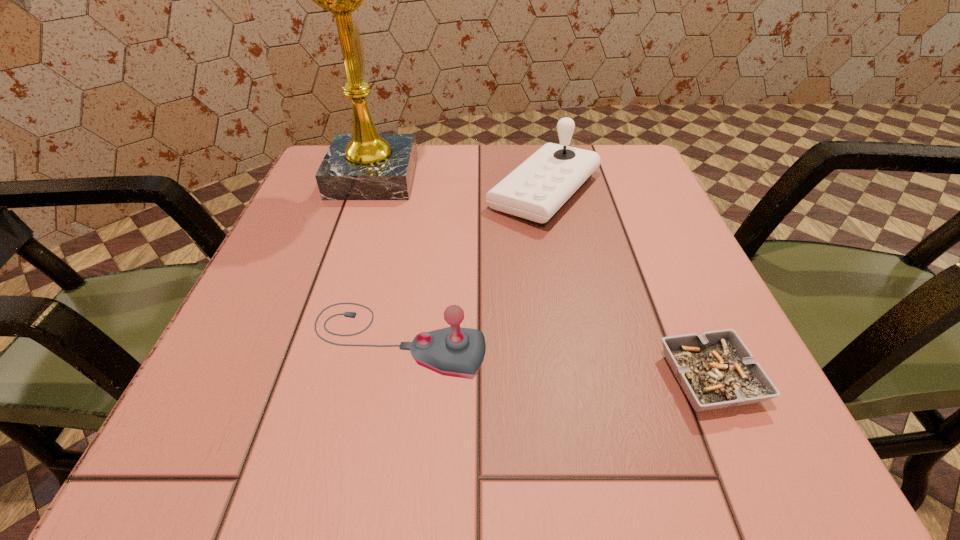
The image size is (960, 540). I want to click on award, so click(x=365, y=165).

At what (x,y) coordinates should I click in order to perform the action: click on the farther joystick. Please return your answer as a coordinate pair (x, y). This screenshot has width=960, height=540. Looking at the image, I should click on (536, 190).

At what (x,y) coordinates should I click in order to perform the action: click on the right joystick. Please return your answer as a coordinate pair (x, y). The height and width of the screenshot is (540, 960). Looking at the image, I should click on (536, 190).

The height and width of the screenshot is (540, 960). What are the coordinates of `the nearer joystick` in the screenshot? It's located at (454, 351).

Identify the location of the second shortest object. This screenshot has width=960, height=540. (454, 351).

Locate an element on the screen. The height and width of the screenshot is (540, 960). ashtray is located at coordinates (716, 370).

I want to click on vacant area situated on the front-facing side of the tallest object, so click(511, 177).

Identify the location of vacant space situated on the front of the third shortest object. The width and height of the screenshot is (960, 540). (575, 359).

In order to click on free space located 0.100m on the left of the left joystick in this screenshot , I will do `click(240, 340)`.

The width and height of the screenshot is (960, 540). In order to click on vacant space located on the left of the shortest object in this screenshot , I will do `click(627, 379)`.